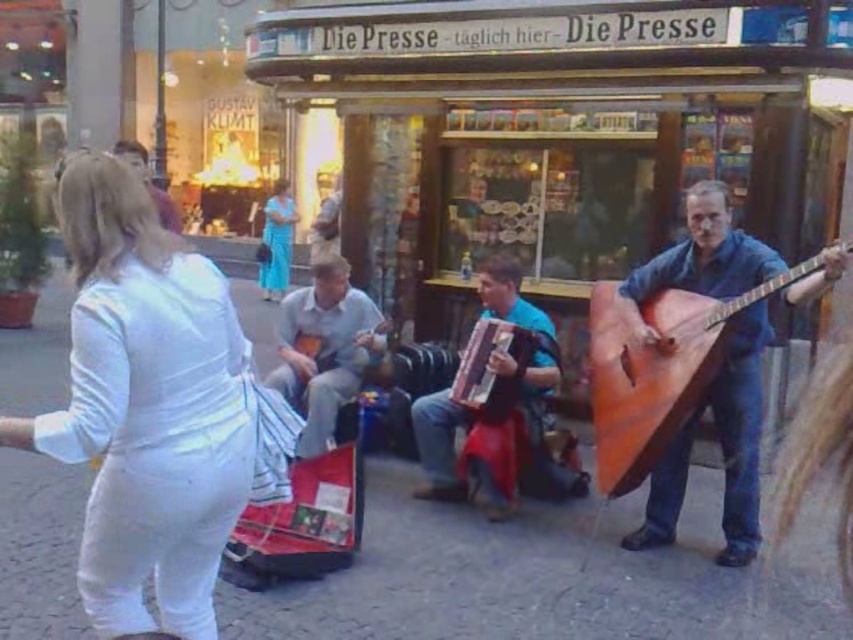
Question: Does blue fabric accordion at center have a smaller size compared to wooden acoustic guitar at center?

Choices:
 (A) yes
 (B) no

Answer: (A)

Question: Which of the following is the closest to the observer?

Choices:
 (A) blue fabric accordion at center
 (B) light brown leather jacket at upper left
 (C) wooden acoustic guitar at center
 (D) blue silk dress at center

Answer: (B)

Question: Which of the following is the farthest from the observer?

Choices:
 (A) (172, 216)
 (B) (281, 253)
 (C) (663, 369)
 (D) (434, 417)

Answer: (B)

Question: From the image, what is the correct spatial relationship of wooden textured accordion at center in relation to blue silk dress at center?

Choices:
 (A) below
 (B) above

Answer: (A)

Question: Is orange wood guitar at right wider than blue silk dress at center?

Choices:
 (A) yes
 (B) no

Answer: (A)

Question: Based on their relative distances, which object is farther from the blue silk dress at center?

Choices:
 (A) wooden textured accordion at center
 (B) light brown leather jacket at upper left
 (C) orange wood guitar at right
 (D) blue fabric accordion at center

Answer: (C)